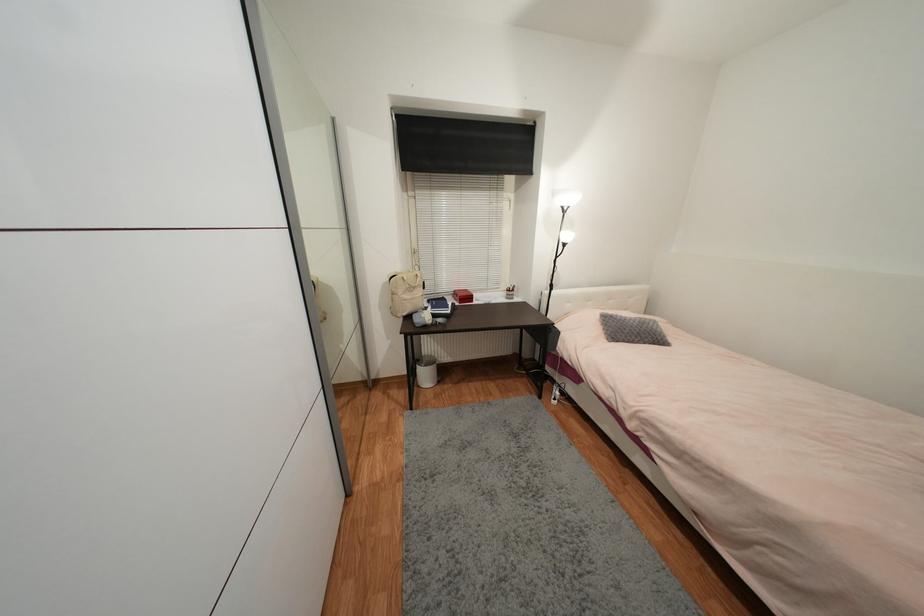
At what (x,y) coordinates should I click in order to perform the action: click on black lamp switch. Please return your answer as a coordinate pair (x, y). Image resolution: width=924 pixels, height=616 pixels. Looking at the image, I should click on (551, 281).